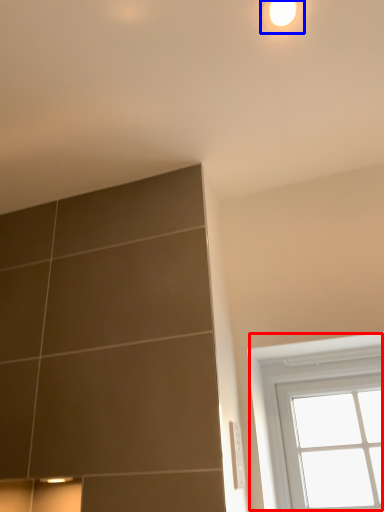
Question: Among these objects, which one is nearest to the camera, window (highlighted by a red box) or light (highlighted by a blue box)?

Choices:
 (A) window
 (B) light

Answer: (B)